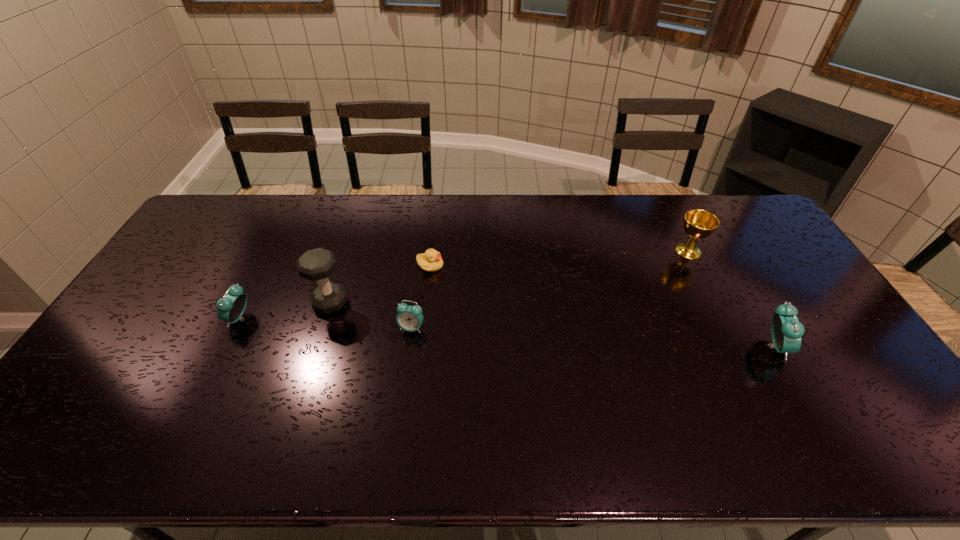
Locate an element on the screen. This screenshot has width=960, height=540. the second shortest alarm clock is located at coordinates point(231,307).

Find the location of a particular element. Image resolution: width=960 pixels, height=540 pixels. the leftmost object is located at coordinates (231, 307).

Find the location of a particular element. This screenshot has height=540, width=960. the fifth tallest object is located at coordinates (409, 318).

Image resolution: width=960 pixels, height=540 pixels. In order to click on the second alarm clock from left to right in this screenshot , I will do `click(409, 318)`.

Locate an element on the screen. Image resolution: width=960 pixels, height=540 pixels. the tallest alarm clock is located at coordinates (787, 331).

Image resolution: width=960 pixels, height=540 pixels. I want to click on the rightmost alarm clock, so click(x=787, y=331).

Locate an element on the screen. This screenshot has width=960, height=540. the fifth object from left to right is located at coordinates (698, 224).

What are the coordinates of `the fifth object from right to left` in the screenshot? It's located at (318, 264).

This screenshot has height=540, width=960. Find the location of `dumbbell`. dumbbell is located at coordinates (318, 264).

In order to click on the shortest object in this screenshot , I will do `click(431, 261)`.